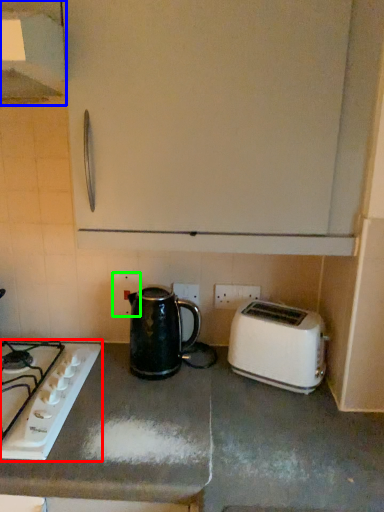
Question: Considering the real-world distances, which object is closest to gas stove (highlighted by a red box)? exhaust hood (highlighted by a blue box) or electric outlet (highlighted by a green box).

Choices:
 (A) exhaust hood
 (B) electric outlet

Answer: (B)